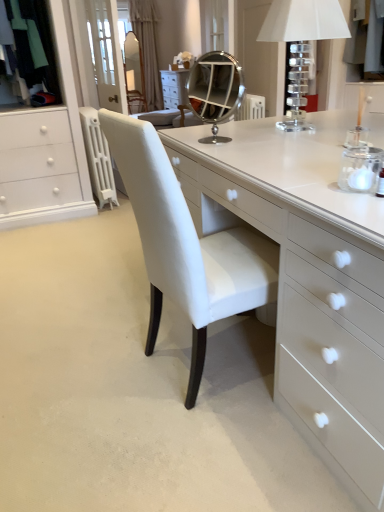
Find the location of `clear acrylic table lamp at upper right`. clear acrylic table lamp at upper right is located at coordinates (301, 44).

What do you see at coordinates (301, 44) in the screenshot? This screenshot has height=512, width=384. I see `clear acrylic table lamp at upper right` at bounding box center [301, 44].

How much space does silver/metallic mirror at center, which appears as the first mirror when viewed from the right, occupy horizontally?

silver/metallic mirror at center, which appears as the first mirror when viewed from the right, is 6.49 inches in width.

At what (x,y) coordinates should I click in order to perform the action: click on white textured curtain at upper center. Please return your answer as a coordinate pair (x, y). Image resolution: width=384 pixels, height=512 pixels. Looking at the image, I should click on (147, 47).

What do you see at coordinates (134, 73) in the screenshot? I see `matte glass mirror at upper center, arranged as the 1th mirror when viewed from the top` at bounding box center [134, 73].

Locate an element on the screen. The image size is (384, 512). gray fabric coat at upper right is located at coordinates (365, 39).

The width and height of the screenshot is (384, 512). What are the coordinates of `white glossy table at center` in the screenshot? It's located at (306, 276).

In the scene shown: From a real-world perspective, does white glossy table at center stand above matte glass mirror at upper center, the 2th mirror from the right?

No.

From the image's perspective, which is below, white glossy table at center or matte glass mirror at upper center, arranged as the 1th mirror when viewed from the top?

white glossy table at center.

Does white glossy table at center have a lesser width compared to matte glass mirror at upper center, the 2th mirror when ordered from front to back?

In fact, white glossy table at center might be wider than matte glass mirror at upper center, the 2th mirror when ordered from front to back.

Is gray fabric coat at upper right bigger or smaller than white textured curtain at upper center?

In the image, gray fabric coat at upper right appears to be smaller than white textured curtain at upper center.

Is point (367, 8) more distant than point (152, 15)?

No, it is in front of (152, 15).

Is gray fabric coat at upper right inside the boundaries of white textured curtain at upper center, or outside?

gray fabric coat at upper right is not inside white textured curtain at upper center, it's outside.

Based on the photo, can you confirm if white glossy table at center is taller than white textured curtain at upper center?

In fact, white glossy table at center may be shorter than white textured curtain at upper center.

Is the surface of white glossy table at center in direct contact with white textured curtain at upper center?

No, white glossy table at center is not with white textured curtain at upper center.

Between white glossy table at center and white textured curtain at upper center, which one appears on the right side from the viewer's perspective?

white glossy table at center.

The image size is (384, 512). In order to click on curtain above the white glossy table at center (from the image's perspective) in this screenshot , I will do `click(147, 47)`.

What's the angular difference between clear acrylic table lamp at upper right and silver/metallic mirror at center, which is the first mirror in bottom-to-top order,'s facing directions?

134 degrees.

Considering the positions of point (303, 41) and point (214, 52), is point (303, 41) closer or farther from the camera than point (214, 52)?

Point (303, 41).

Is clear acrylic table lamp at upper right turned away from silver/metallic mirror at center, which is the second mirror from back to front?

Yes, silver/metallic mirror at center, which is the second mirror from back to front, is at the back of clear acrylic table lamp at upper right.

Between point (301, 140) and point (228, 78), which one is positioned in front?

Point (301, 140)

Can you confirm if white glossy table at center is bigger than silver/metallic mirror at center, the 2th mirror when ordered from left to right?

Correct, white glossy table at center is larger in size than silver/metallic mirror at center, the 2th mirror when ordered from left to right.

From a real-world perspective, which object rests below the other?

white glossy table at center, from a real-world perspective.

Can you tell me how much white glossy table at center and silver/metallic mirror at center, which ranks as the 2th mirror in top-to-bottom order, differ in facing direction?

They differ by 127 degrees in their facing directions.

How different are the orientations of white textured curtain at upper center and silver/metallic mirror at center, which is the first mirror in bottom-to-top order, in degrees?

52.4 degrees.

Is white textured curtain at upper center next to silver/metallic mirror at center, which is the first mirror in bottom-to-top order, and touching it?

No, white textured curtain at upper center is not touching silver/metallic mirror at center, which is the first mirror in bottom-to-top order.

Consider the image. Between white textured curtain at upper center and silver/metallic mirror at center, which appears as the first mirror when viewed from the right, which one has smaller size?

Smaller between the two is silver/metallic mirror at center, which appears as the first mirror when viewed from the right.

From the image's perspective, is white textured curtain at upper center positioned above or below silver/metallic mirror at center, which is the second mirror from back to front?

white textured curtain at upper center is above silver/metallic mirror at center, which is the second mirror from back to front.

From the image's perspective, is white textured curtain at upper center on top of clear acrylic table lamp at upper right?

Indeed, from the image's perspective, white textured curtain at upper center is shown above clear acrylic table lamp at upper right.

Is white textured curtain at upper center aimed at clear acrylic table lamp at upper right?

Yes, white textured curtain at upper center faces towards clear acrylic table lamp at upper right.

How far apart are white textured curtain at upper center and clear acrylic table lamp at upper right?

The distance of white textured curtain at upper center from clear acrylic table lamp at upper right is 2.50 meters.

At what (x,y) coordinates should I click in order to perform the action: click on table located on the right of matte glass mirror at upper center, the 2th mirror from the right. Please return your answer as a coordinate pair (x, y). Image resolution: width=384 pixels, height=512 pixels. Looking at the image, I should click on (306, 276).

I want to click on curtain that is under the gray fabric coat at upper right (from a real-world perspective), so click(147, 47).

Which object lies nearer to the anchor point matte glass mirror at upper center, the 2th mirror when ordered from front to back, gray fabric coat at upper right or white glossy table at center?

gray fabric coat at upper right is positioned closer to the anchor matte glass mirror at upper center, the 2th mirror when ordered from front to back.

Looking at the image, which one is located closer to clear acrylic table lamp at upper right, white textured curtain at upper center or white glossy table at center?

Among the two, white textured curtain at upper center is located nearer to clear acrylic table lamp at upper right.

Which object lies further to the anchor point matte glass mirror at upper center, the first mirror viewed from the back, white glossy table at center or gray fabric coat at upper right?

Among the two, white glossy table at center is located further to matte glass mirror at upper center, the first mirror viewed from the back.

Which object lies nearer to the anchor point matte glass mirror at upper center, the first mirror viewed from the back, white textured curtain at upper center or gray fabric coat at upper right?

white textured curtain at upper center is positioned closer to the anchor matte glass mirror at upper center, the first mirror viewed from the back.

Looking at the image, which one is located further to silver/metallic mirror at center, which ranks as the 2th mirror in top-to-bottom order, clear acrylic table lamp at upper right or white textured curtain at upper center?

white textured curtain at upper center.

Considering their positions, is white textured curtain at upper center positioned closer to gray fabric coat at upper right than clear acrylic table lamp at upper right?

clear acrylic table lamp at upper right is positioned closer to the anchor gray fabric coat at upper right.

When comparing their distances from white textured curtain at upper center, does white glossy table at center or clear acrylic table lamp at upper right seem closer?

clear acrylic table lamp at upper right lies closer to white textured curtain at upper center than the other object.

Based on their spatial positions, is white textured curtain at upper center or matte glass mirror at upper center, positioned as the 2th mirror in bottom-to-top order, further from clear acrylic table lamp at upper right?

matte glass mirror at upper center, positioned as the 2th mirror in bottom-to-top order.

Locate an element on the screen. This screenshot has height=512, width=384. clothing between white glossy table at center and white textured curtain at upper center in the front-back direction is located at coordinates click(365, 39).

Where is `mirror between silver/metallic mirror at center, which is the second mirror from back to front, and white textured curtain at upper center from front to back`? This screenshot has height=512, width=384. mirror between silver/metallic mirror at center, which is the second mirror from back to front, and white textured curtain at upper center from front to back is located at coordinates (134, 73).

Locate an element on the screen. mirror between gray fabric coat at upper right and white textured curtain at upper center in the front-back direction is located at coordinates (134, 73).

Image resolution: width=384 pixels, height=512 pixels. I want to click on mirror located between white glossy table at center and matte glass mirror at upper center, which ranks as the 1th mirror in left-to-right order, in the depth direction, so click(214, 91).